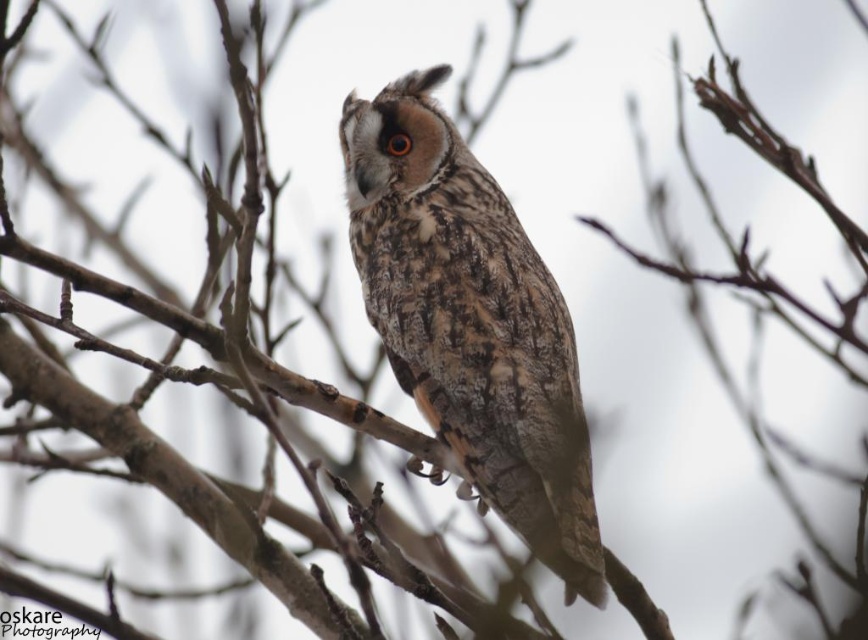
Who is lower down, camouflage feathered owl at center or brown textured eye at center?

Positioned lower is camouflage feathered owl at center.

Measure the distance between camouflage feathered owl at center and camera.

The distance of camouflage feathered owl at center from camera is 2.35 meters.

At what (x,y) coordinates should I click in order to perform the action: click on camouflage feathered owl at center. Please return your answer as a coordinate pair (x, y). Looking at the image, I should click on (472, 323).